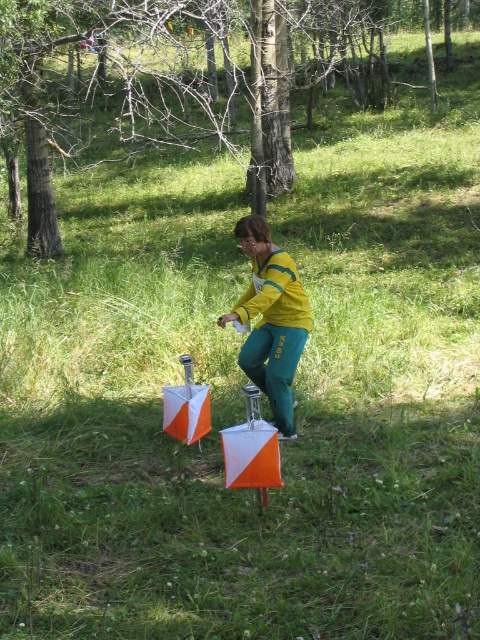
Question: Where is brown wood tree at upper center located in relation to yellow fabric pants at center in the image?

Choices:
 (A) below
 (B) above

Answer: (B)

Question: Is brown wood tree at upper center thinner than yellow fabric pants at center?

Choices:
 (A) yes
 (B) no

Answer: (B)

Question: Which of the following is the closest to the observer?

Choices:
 (A) yellow fabric pants at center
 (B) brown wood tree at upper center

Answer: (A)

Question: Among these points, which one is farthest from the camera?

Choices:
 (A) (249, 253)
 (B) (132, 42)

Answer: (B)

Question: Does brown wood tree at upper center appear on the right side of yellow fabric pants at center?

Choices:
 (A) yes
 (B) no

Answer: (A)